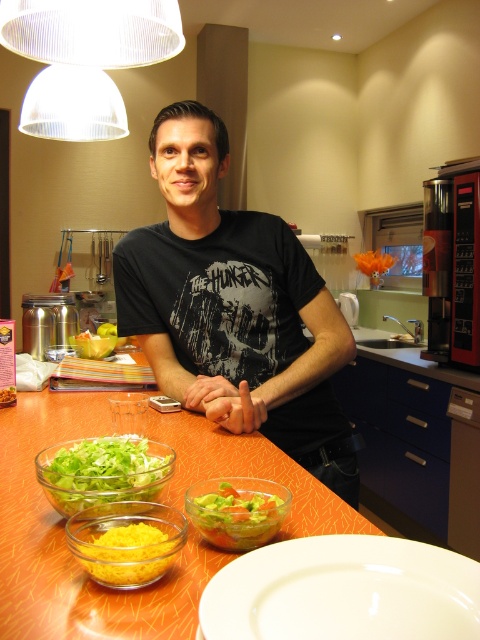
You are standing in the kitchen scene and want to reach both points mentioned. Which point, point (41, 481) or point (393, 397), would you reach first?

You would reach point (41, 481) first because it is closer to you than point (393, 397).

You are preparing to place a large salad into the green glass salad bowl at lower left and need to ensure it fits on the dark blue matte drawer at lower right. Can you confirm if the salad bowl will fit on the drawer based on their widths?

The green glass salad bowl at lower left might be wider than dark blue matte drawer at lower right, so there is a possibility that the salad bowl will not fit on the drawer if its width exceeds the drawer.

You are preparing a salad and need to choose between the yellow matte bowl at lower left and the translucent glass bowl at center. Which bowl is taller?

The yellow matte bowl at lower left is taller than the translucent glass bowl at center.